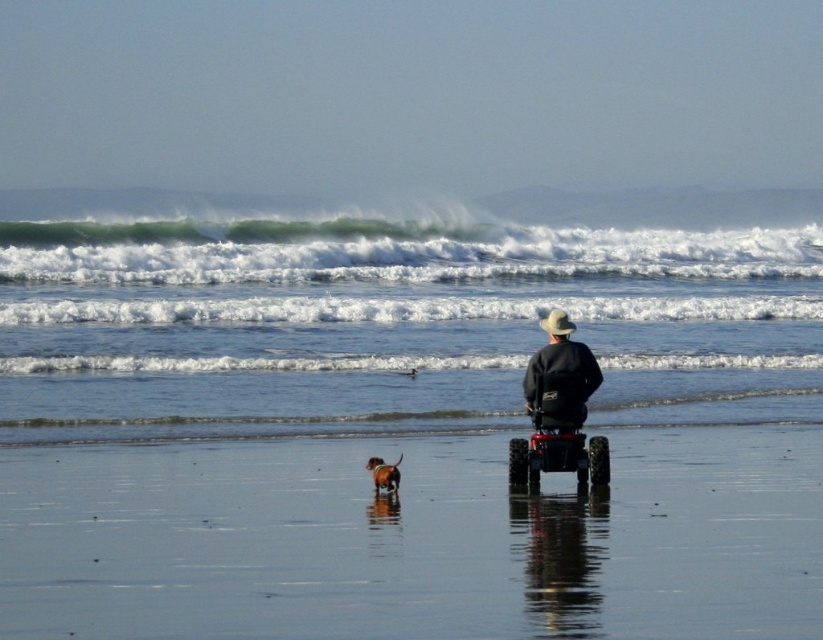
Question: Does matte black jacket at center appear on the right side of black rubber wheelchair at center?

Choices:
 (A) yes
 (B) no

Answer: (B)

Question: Which object is closer to the camera taking this photo?

Choices:
 (A) black rubber wheelchair at center
 (B) brown furry dog at center
 (C) shiny metallic beach at center
 (D) white frothy wave at upper center

Answer: (C)

Question: In this image, where is matte black jacket at center located relative to brown furry dog at center?

Choices:
 (A) left
 (B) right

Answer: (B)

Question: Among these points, which one is nearest to the camera?

Choices:
 (A) (529, 385)
 (B) (250, 452)
 (C) (228, 248)

Answer: (A)

Question: Can you confirm if shiny metallic beach at center is positioned to the right of white frothy wave at upper center?

Choices:
 (A) yes
 (B) no

Answer: (B)

Question: Which object is positioned farthest from the shiny metallic beach at center?

Choices:
 (A) white frothy wave at upper center
 (B) matte black jacket at center
 (C) black rubber wheelchair at center

Answer: (A)